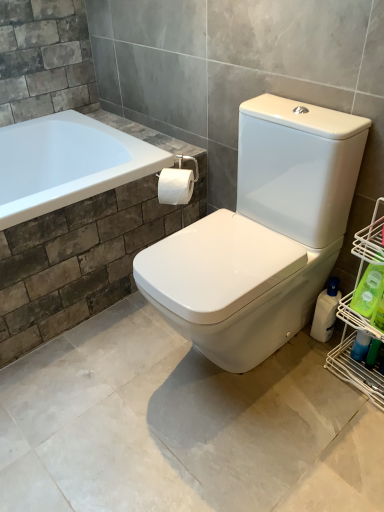
Question: Should I look upward or downward to see blue glossy spray bottle at lower right, which is the second cleaning product from back to front?

Choices:
 (A) down
 (B) up

Answer: (A)

Question: Can green plastic bottle at lower right, which is counted as the third cleaning product, starting from the back, be found inside blue glossy spray bottle at lower right, which is the second cleaning product from back to front?

Choices:
 (A) no
 (B) yes

Answer: (A)

Question: Considering the relative sizes of blue glossy spray bottle at lower right, the second cleaning product in the front-to-back sequence, and green plastic bottle at lower right, which is counted as the third cleaning product, starting from the back, in the image provided, is blue glossy spray bottle at lower right, the second cleaning product in the front-to-back sequence, bigger than green plastic bottle at lower right, which is counted as the third cleaning product, starting from the back,?

Choices:
 (A) no
 (B) yes

Answer: (A)

Question: From a real-world perspective, is blue glossy spray bottle at lower right, the second cleaning product in the front-to-back sequence, under green plastic bottle at lower right, acting as the first cleaning product starting from the front?

Choices:
 (A) yes
 (B) no

Answer: (A)

Question: Is blue glossy spray bottle at lower right, which is the second cleaning product from back to front, positioned with its back to green plastic bottle at lower right, acting as the first cleaning product starting from the front?

Choices:
 (A) no
 (B) yes

Answer: (A)

Question: From a real-world perspective, does blue glossy spray bottle at lower right, the second cleaning product in the front-to-back sequence, stand above green plastic bottle at lower right, which is counted as the third cleaning product, starting from the back?

Choices:
 (A) no
 (B) yes

Answer: (A)

Question: Are blue glossy spray bottle at lower right, which is the second cleaning product from back to front, and green plastic bottle at lower right, which is counted as the third cleaning product, starting from the back, beside each other?

Choices:
 (A) yes
 (B) no

Answer: (B)

Question: Does white plastic bottle at right, which is the first cleaning product in back-to-front order, have a smaller size compared to green plastic bottle at lower right, which is counted as the third cleaning product, starting from the back?

Choices:
 (A) no
 (B) yes

Answer: (A)

Question: From a real-world perspective, is white plastic bottle at right, the 3th cleaning product from the front, over green plastic bottle at lower right, which is counted as the third cleaning product, starting from the back?

Choices:
 (A) no
 (B) yes

Answer: (A)

Question: Could you tell me if white plastic bottle at right, which is the first cleaning product in back-to-front order, is facing green plastic bottle at lower right, which is counted as the third cleaning product, starting from the back?

Choices:
 (A) yes
 (B) no

Answer: (B)

Question: Is white plastic bottle at right, which is the first cleaning product in back-to-front order, positioned with its back to green plastic bottle at lower right, which is counted as the third cleaning product, starting from the back?

Choices:
 (A) yes
 (B) no

Answer: (B)

Question: From the image's perspective, does white plastic bottle at right, which is the first cleaning product in back-to-front order, appear higher than green plastic bottle at lower right, which is counted as the third cleaning product, starting from the back?

Choices:
 (A) yes
 (B) no

Answer: (B)

Question: Is white plastic bottle at right, the 3th cleaning product from the front, thinner than green plastic bottle at lower right, which is counted as the third cleaning product, starting from the back?

Choices:
 (A) no
 (B) yes

Answer: (A)

Question: Considering the relative sizes of blue glossy spray bottle at lower right, the second cleaning product in the front-to-back sequence, and white matte toilet paper at center in the image provided, is blue glossy spray bottle at lower right, the second cleaning product in the front-to-back sequence, thinner than white matte toilet paper at center?

Choices:
 (A) no
 (B) yes

Answer: (B)